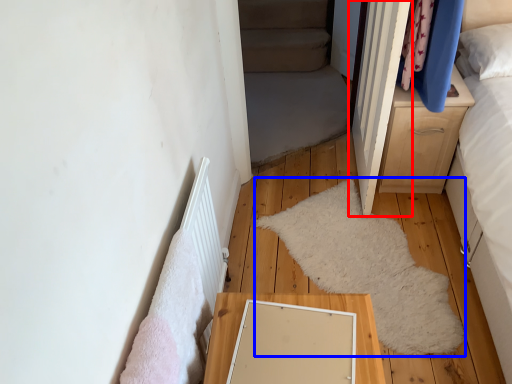
Question: Which object appears farthest to the camera in this image, door (highlighted by a red box) or mat (highlighted by a blue box)?

Choices:
 (A) door
 (B) mat

Answer: (B)